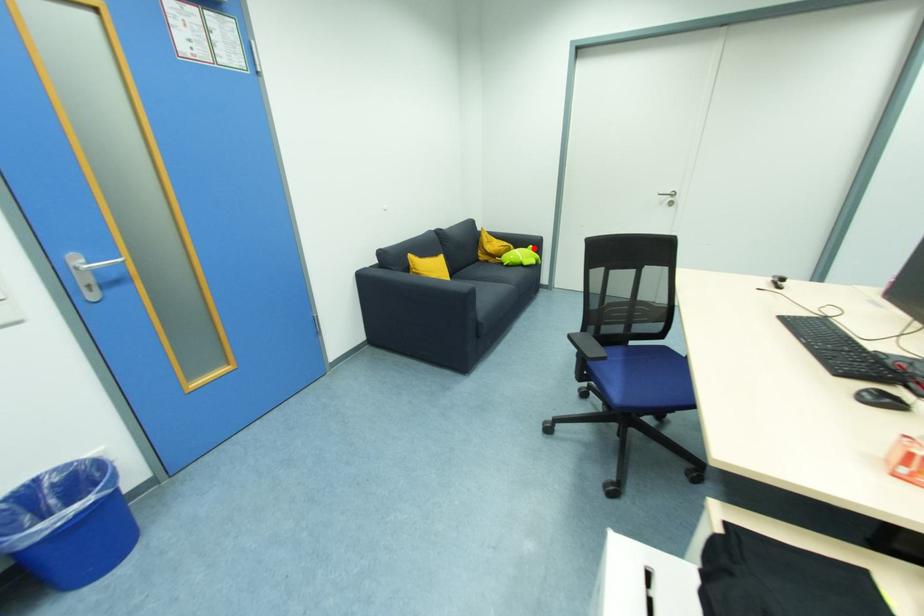
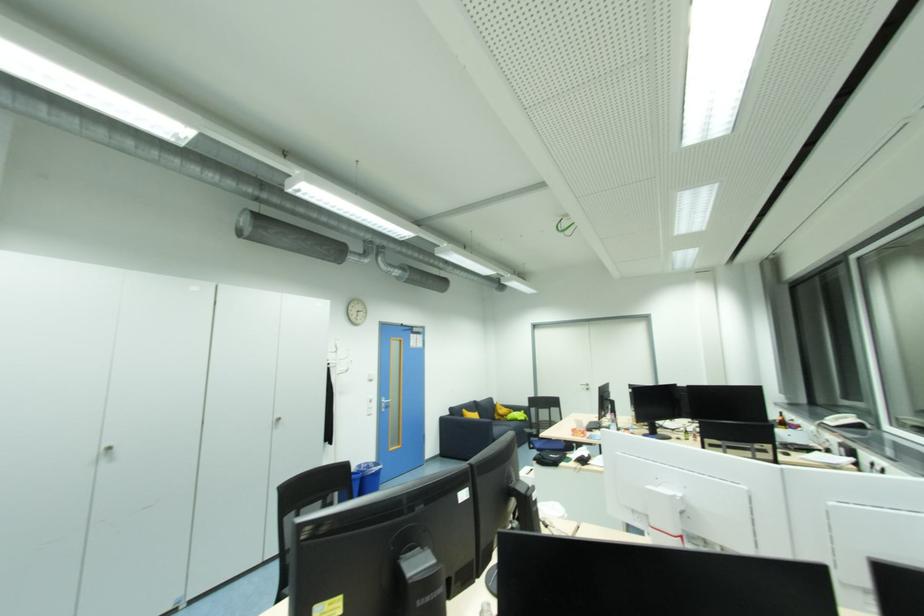
Where in the second image is the point corresponding to the highlighted location from the first image?

(526, 413)